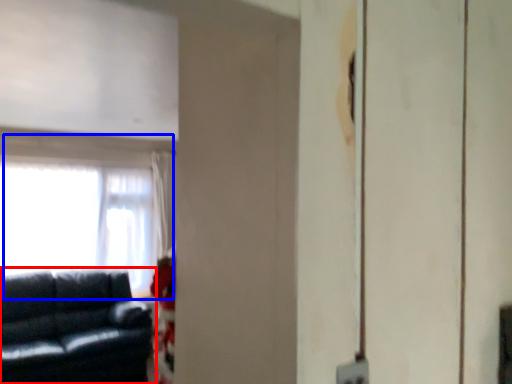
Question: Which point is closer to the camera, studio couch (highlighted by a red box) or window (highlighted by a blue box)?

Choices:
 (A) studio couch
 (B) window

Answer: (A)